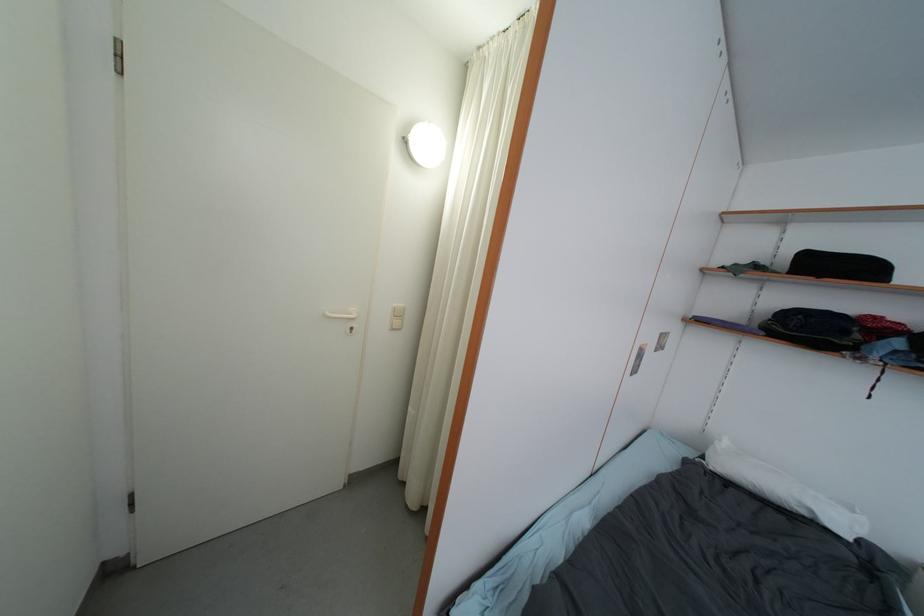
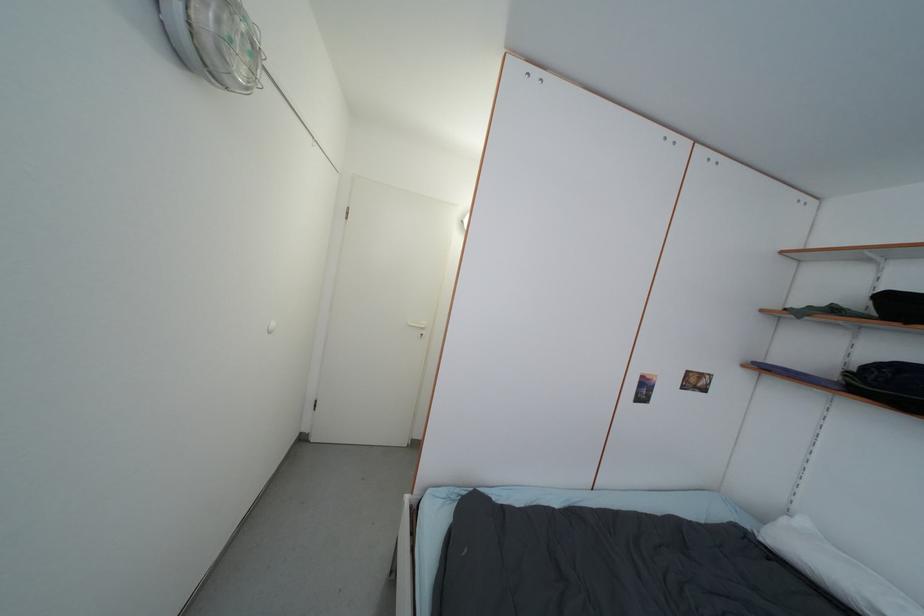
The point at (755,491) is marked in the first image. Where is the corresponding point in the second image?

(812, 576)